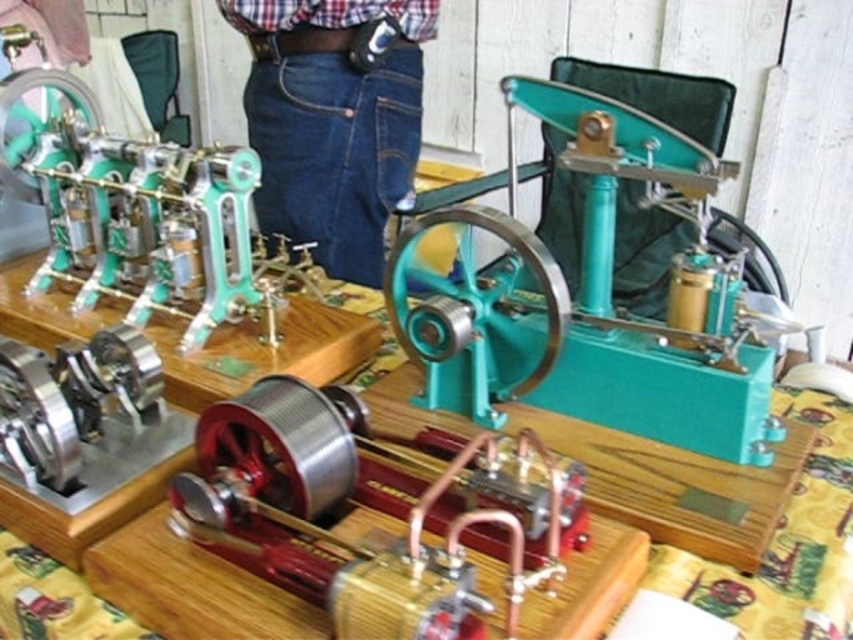
Question: Which object appears closest to the camera in this image?

Choices:
 (A) plaid cotton shirt at upper center
 (B) denim jeans at center

Answer: (A)

Question: Which point is farther to the camera?

Choices:
 (A) (426, 17)
 (B) (401, 81)

Answer: (A)

Question: Does denim jeans at center lie behind plaid cotton shirt at upper center?

Choices:
 (A) no
 (B) yes

Answer: (B)

Question: Observing the image, what is the correct spatial positioning of denim jeans at center in reference to plaid cotton shirt at upper center?

Choices:
 (A) left
 (B) right

Answer: (B)

Question: Is denim jeans at center further to the viewer compared to plaid cotton shirt at upper center?

Choices:
 (A) yes
 (B) no

Answer: (A)